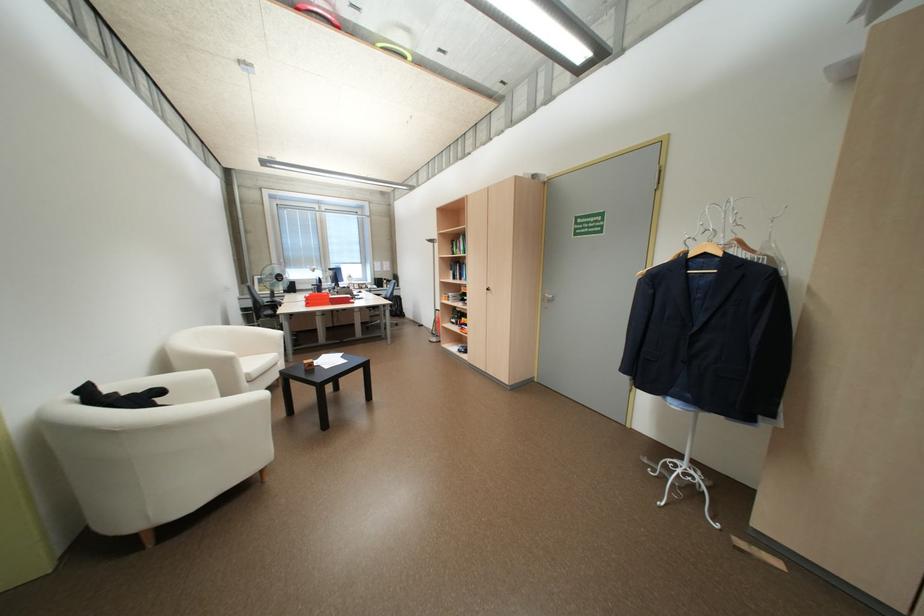
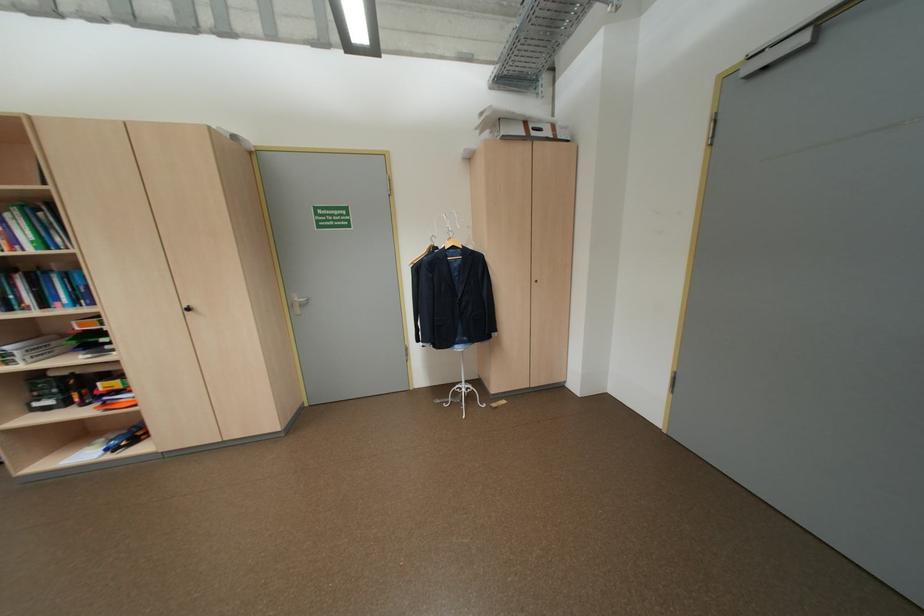
Question: How did the camera likely rotate?

Choices:
 (A) Left
 (B) Right
 (C) Up
 (D) Down

Answer: (B)